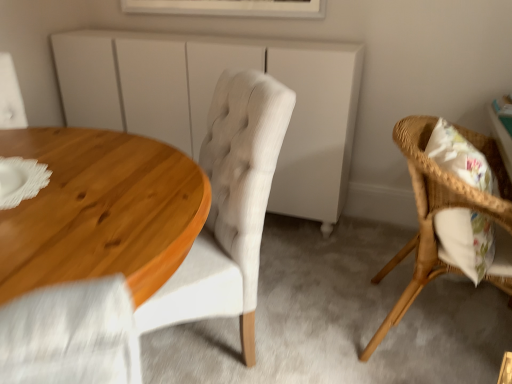
Question: From the image's perspective, relative to white matte cabinet at center, is white framed picture at upper center above or below?

Choices:
 (A) below
 (B) above

Answer: (B)

Question: Based on their sizes in the image, would you say white framed picture at upper center is bigger or smaller than white matte cabinet at center?

Choices:
 (A) big
 (B) small

Answer: (B)

Question: Which object is positioned farthest from the white framed picture at upper center?

Choices:
 (A) white matte cabinet at center
 (B) wooden table at left
 (C) light beige fabric chair at center, the 2th chair positioned from the right
 (D) woven wood chair at right, marked as the 2th chair in a left-to-right arrangement

Answer: (B)

Question: Considering the real-world distances, which object is farthest from the light beige fabric chair at center, which is the first chair in left-to-right order?

Choices:
 (A) white matte cabinet at center
 (B) white framed picture at upper center
 (C) wooden table at left
 (D) woven wood chair at right, which is the 1th chair in right-to-left order

Answer: (B)